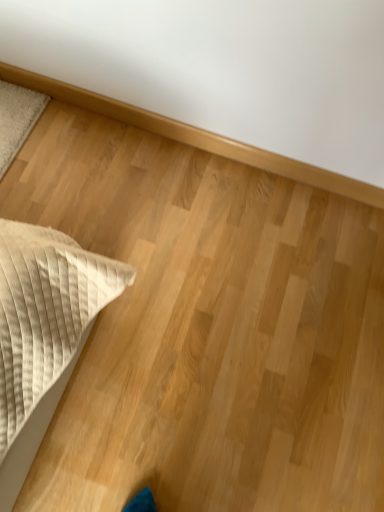
At what (x,y) coordinates should I click in order to perform the action: click on vacant space situated above natural wood baseboard at upper center (from a real-world perspective). Please return your answer as a coordinate pair (x, y). The height and width of the screenshot is (512, 384). Looking at the image, I should click on (215, 130).